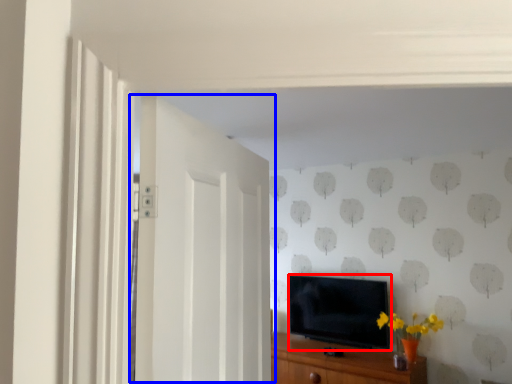
Question: Which object is closer to the camera taking this photo, television (highlighted by a red box) or door (highlighted by a blue box)?

Choices:
 (A) television
 (B) door

Answer: (B)